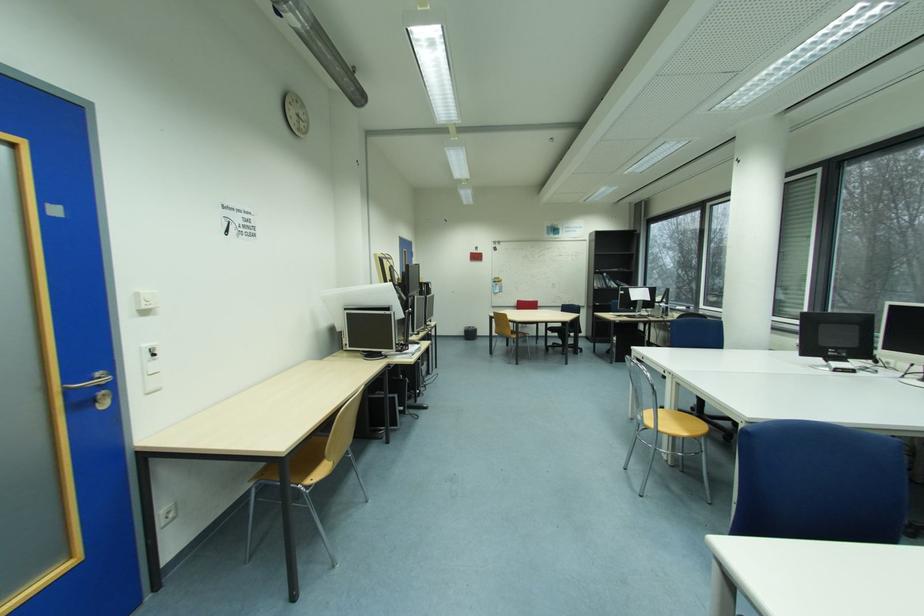
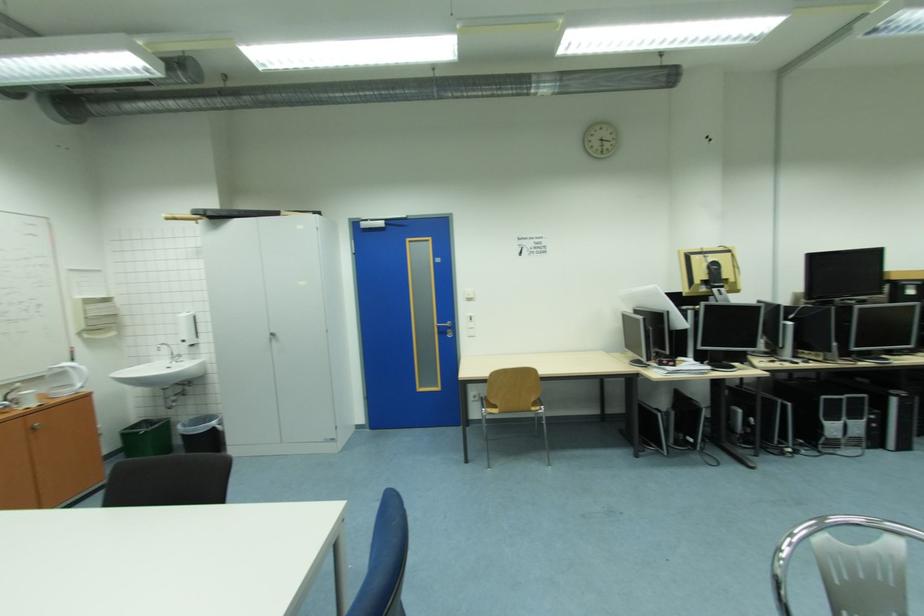
Find the pixel in the second image that matches [179,515] in the first image.

(483, 400)